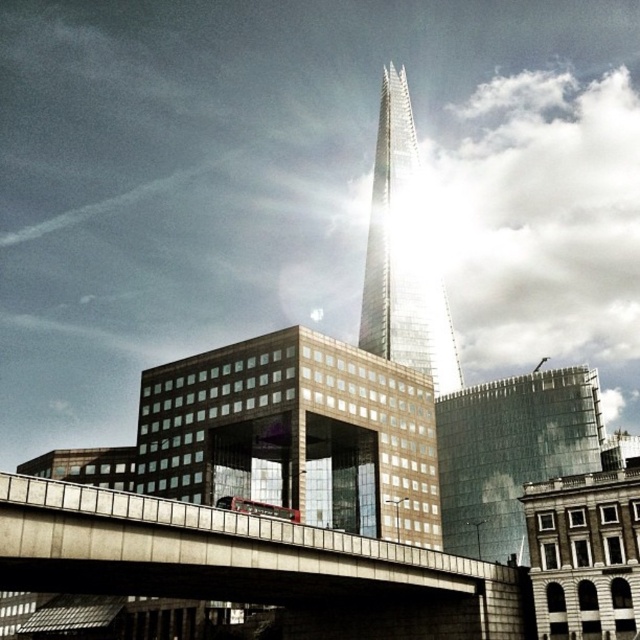
Is point (497, 602) behind point (387, 243)?

No, it is in front of (387, 243).

Can you confirm if concrete bridge at center is thinner than shiny glass skyscraper at center?

No.

Find the location of `concrete bridge at center`. concrete bridge at center is located at coordinates (248, 564).

Locate an element on the screen. concrete bridge at center is located at coordinates (248, 564).